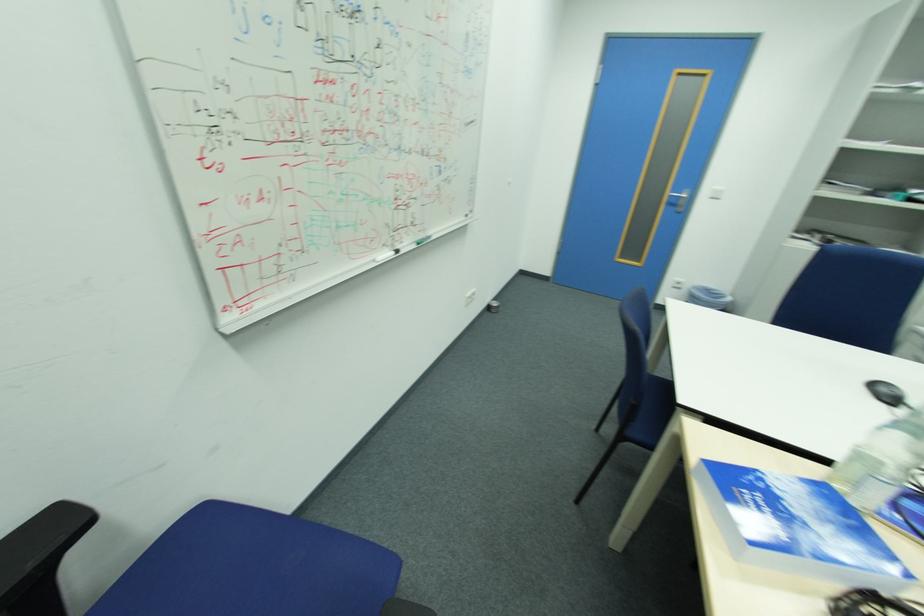
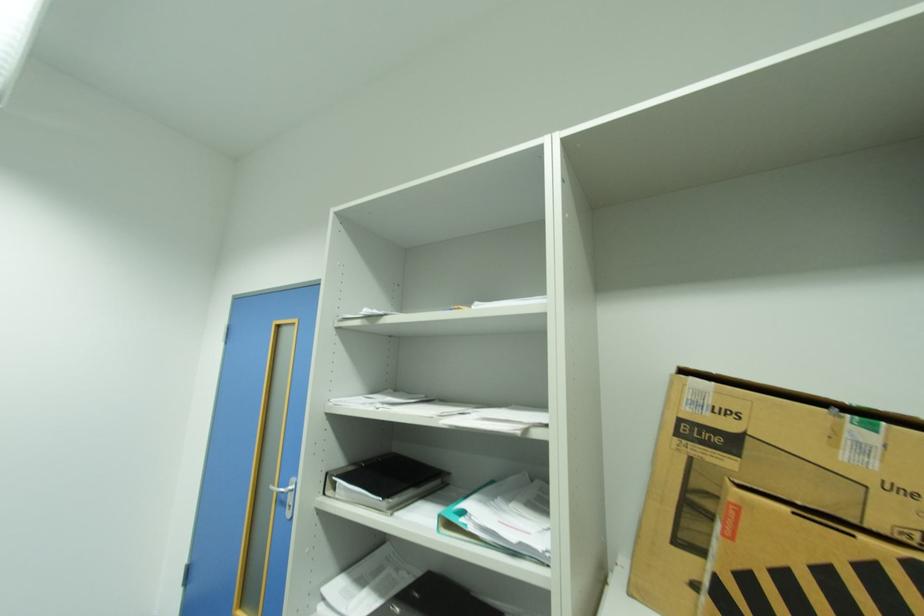
In the second image, find the point that corresponds to pixel 678 203 in the first image.

(287, 498)